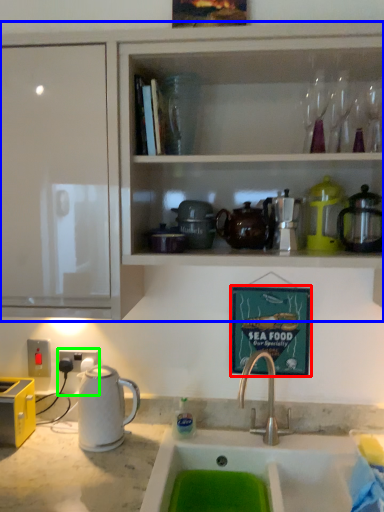
Question: Which object is positioned closest to picture frame (highlighted by a red box)? Select from cabinetry (highlighted by a blue box) and electric outlet (highlighted by a green box).

Choices:
 (A) cabinetry
 (B) electric outlet

Answer: (A)